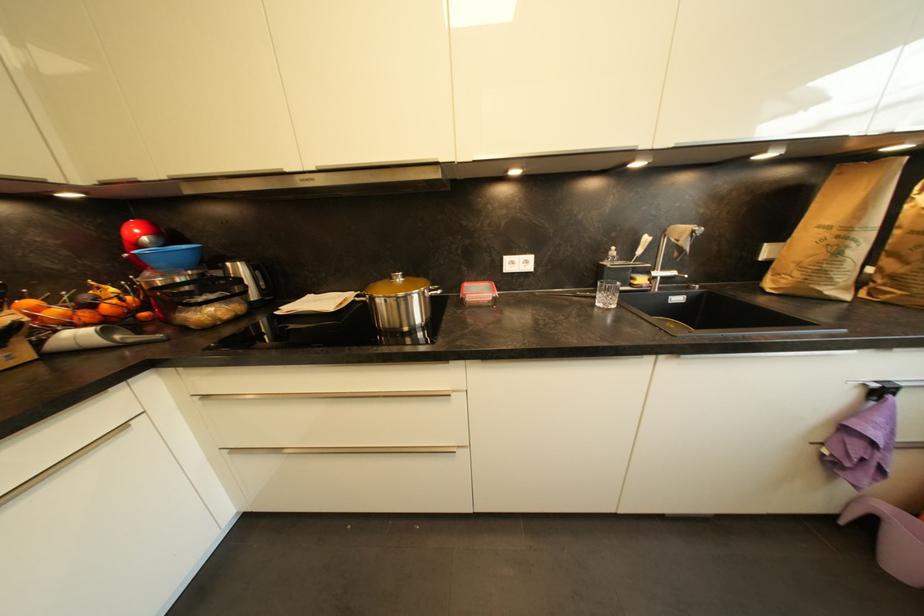
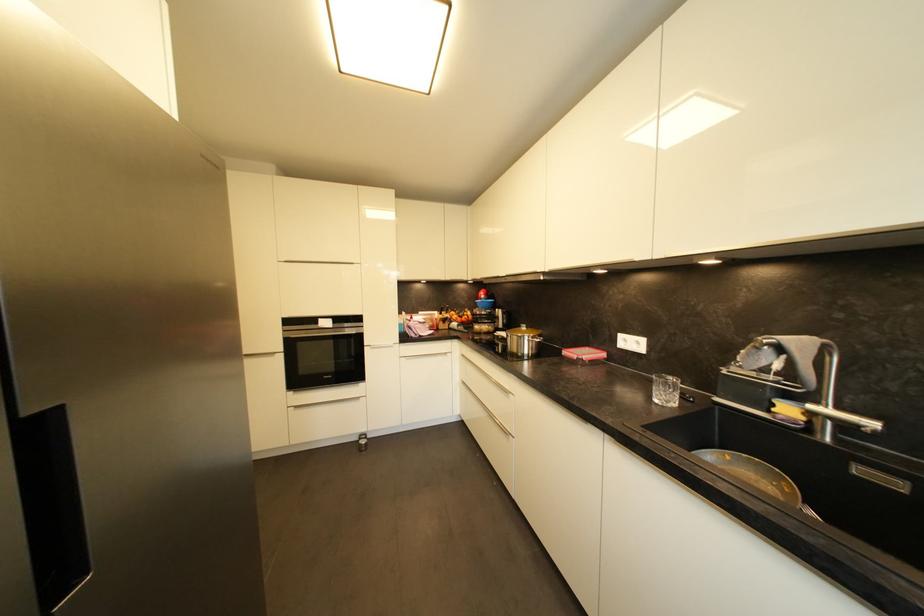
Where in the second image is the point corresponding to point 408,278 from the first image?

(531, 330)